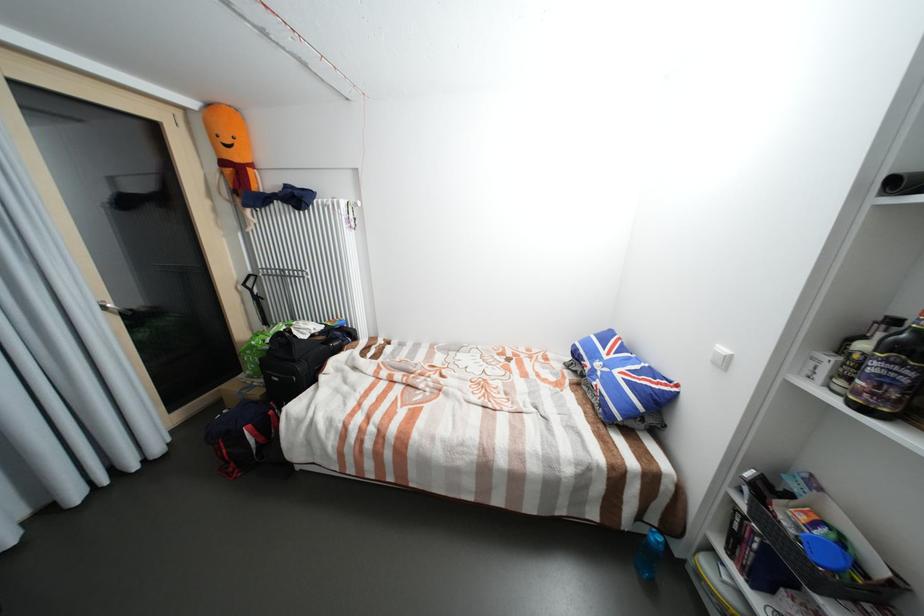
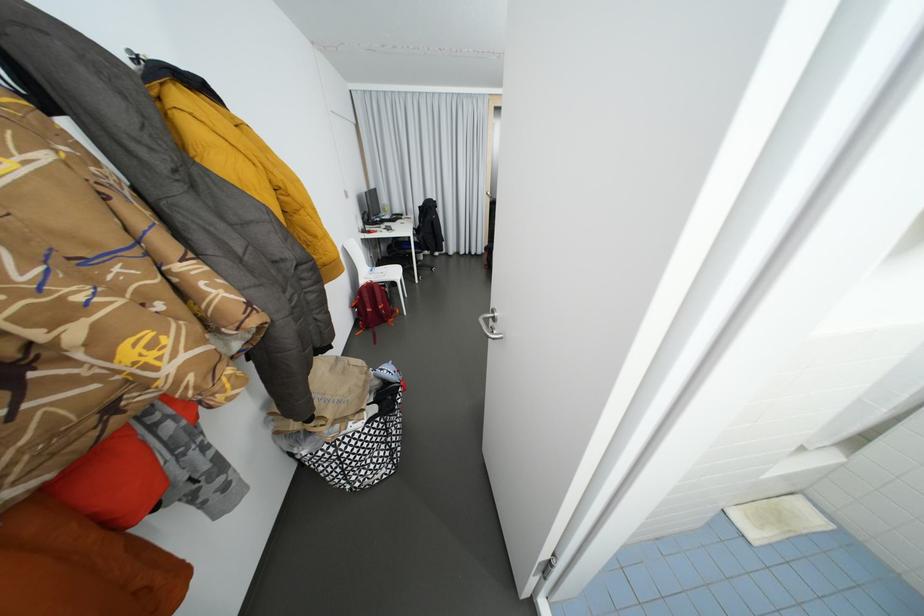
Question: I am providing you with two images of the same scene from different viewpoints. Please identify which objects are invisible in image2.

Choices:
 (A) gray and white pillow
 (B) white label bottle
 (C) white chair sitting surface
 (D) red backpack

Answer: (B)